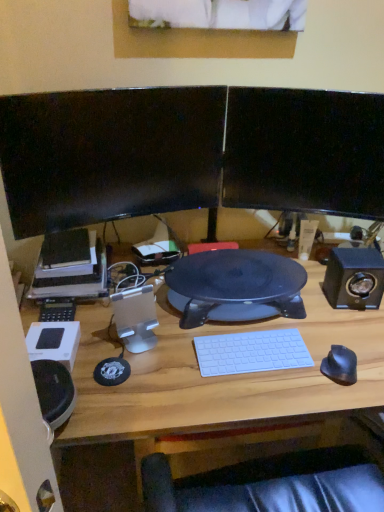
Image resolution: width=384 pixels, height=512 pixels. Identify the location of vacant area to the right of white plastic keyboard at center. tap(322, 358).